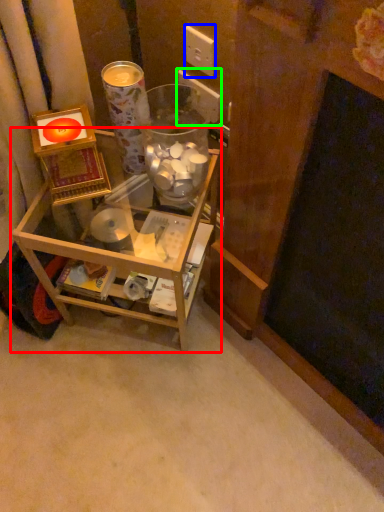
Question: Which object is the closest to the furniture (highlighted by a red box)? Choose among these: electric outlet (highlighted by a blue box) or electric outlet (highlighted by a green box).

Choices:
 (A) electric outlet
 (B) electric outlet

Answer: (B)